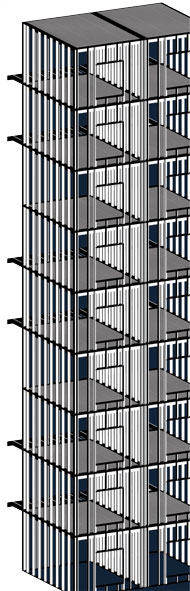
Identify the location of eighth floor rooms. This screenshot has height=591, width=190. (104, 147), (173, 139).